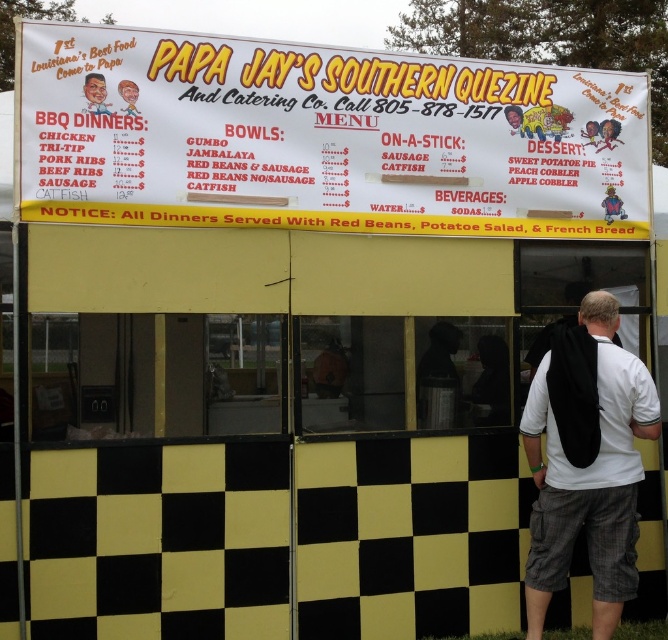
From the picture: You are standing at the food stand and want to know which of the two points, point (x=96, y=74) or point (x=130, y=93), is closer to you. According to the scene description, which point is nearer?

Point (x=96, y=74) is in front of point (x=130, y=93), so it is closer to you.

Looking at this image, you are looking at the menu board of PAPA JAY SOUTHERN QUEZINE. You see a smooth plastic head at upper left and a matte black sign at upper center. Which object is located higher on the menu board?

The smooth plastic head at upper left is located higher on the menu board than the matte black sign at upper center.